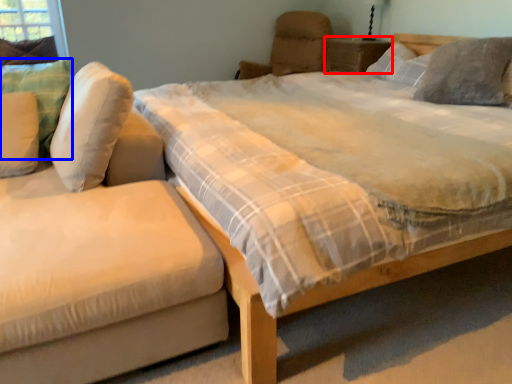
Question: Which object is closer to the camera taking this photo, nightstand (highlighted by a red box) or pillow (highlighted by a blue box)?

Choices:
 (A) nightstand
 (B) pillow

Answer: (B)